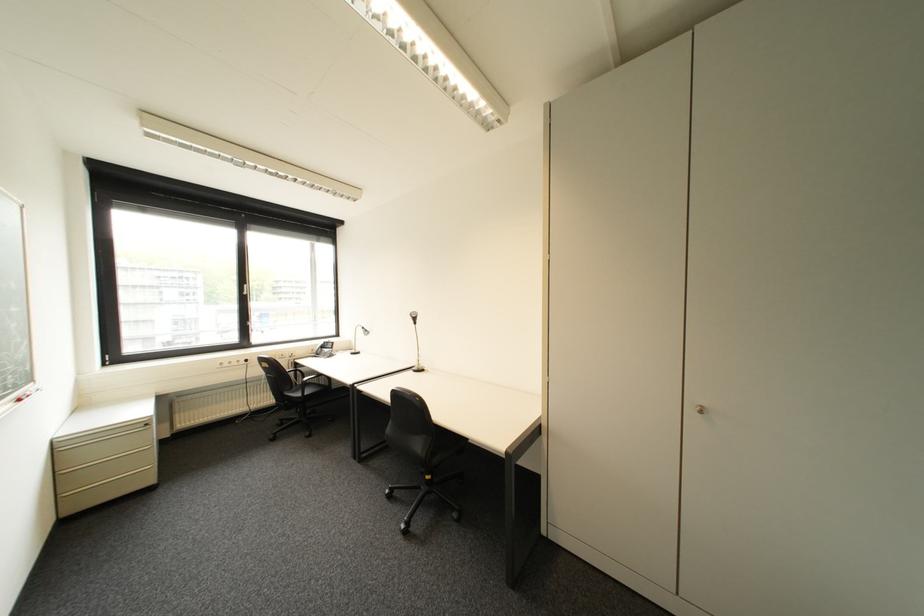
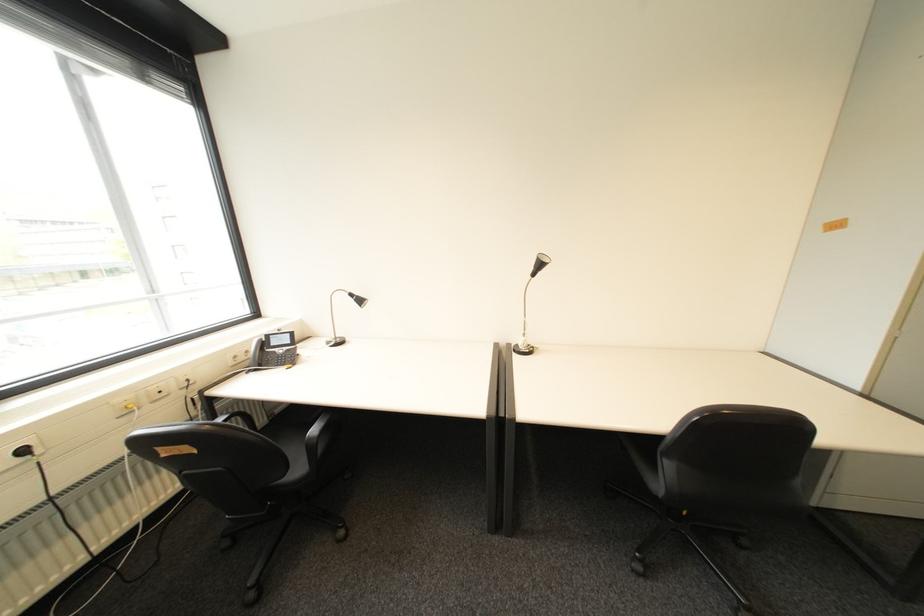
Where in the second image is the point corresponding to [257,361] from the first image?

(34, 452)